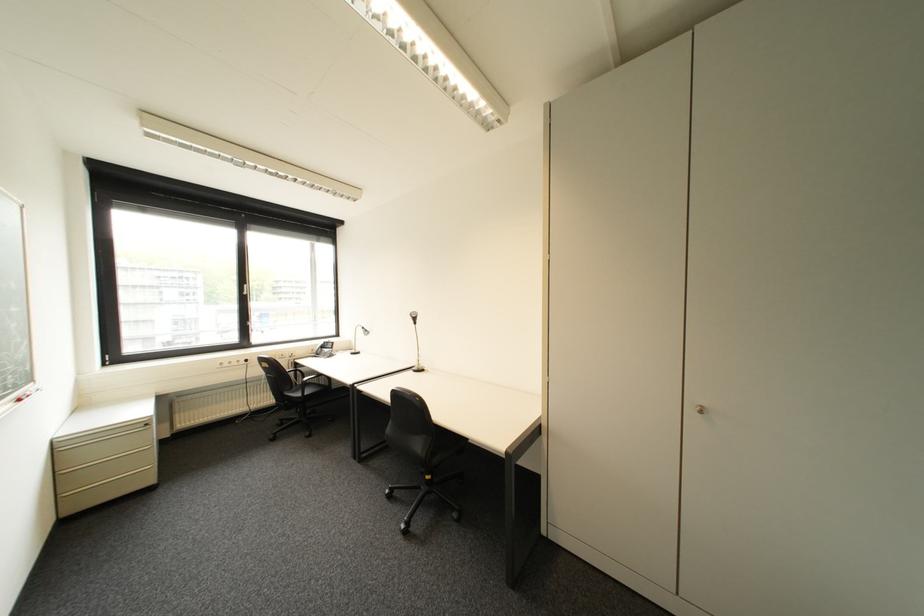
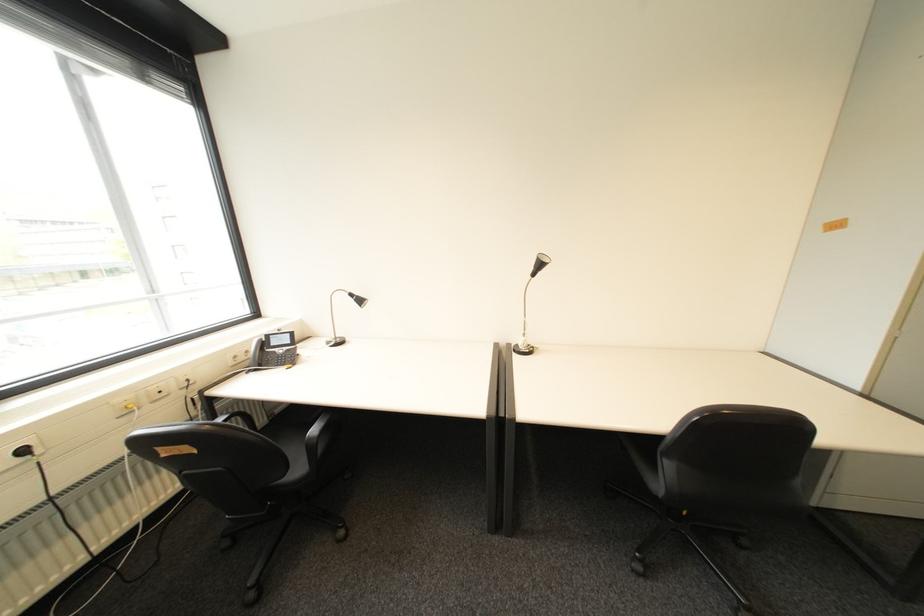
Where in the second image is the point corresponding to [257,361] from the first image?

(34, 452)